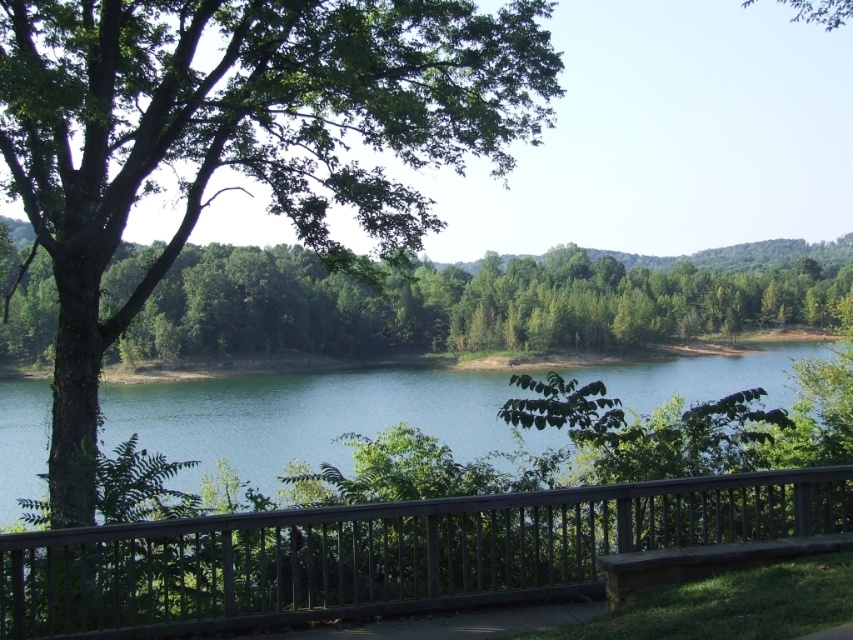
Is dark brown wooden rail at center wider than green water at center?

Incorrect, dark brown wooden rail at center's width does not surpass green water at center's.

Find the location of a particular element. The height and width of the screenshot is (640, 853). dark brown wooden rail at center is located at coordinates (386, 554).

Who is more distant from viewer, (396, 548) or (264, 428)?

Point (264, 428)

Locate an element on the screen. This screenshot has width=853, height=640. dark brown wooden rail at center is located at coordinates (386, 554).

Is dark brown wooden rail at center shorter than green leafy tree at center?

Correct, dark brown wooden rail at center is not as tall as green leafy tree at center.

Which of these two, dark brown wooden rail at center or green leafy tree at center, stands taller?

green leafy tree at center is taller.

Is point (57, 616) closer to camera compared to point (505, 278)?

That is True.

Where is `dark brown wooden rail at center`? The image size is (853, 640). dark brown wooden rail at center is located at coordinates (386, 554).

Who is positioned more to the left, green leafy tree at center or green water at center?

green water at center

Who is higher up, green leafy tree at center or green water at center?

Positioned higher is green leafy tree at center.

Describe the element at coordinates (467, 304) in the screenshot. I see `green leafy tree at center` at that location.

This screenshot has width=853, height=640. Find the location of `green leafy tree at center`. green leafy tree at center is located at coordinates (467, 304).